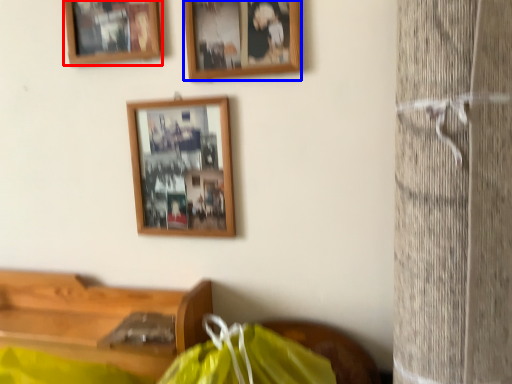
Question: Which point is closer to the camera, picture frame (highlighted by a red box) or picture frame (highlighted by a blue box)?

Choices:
 (A) picture frame
 (B) picture frame

Answer: (B)